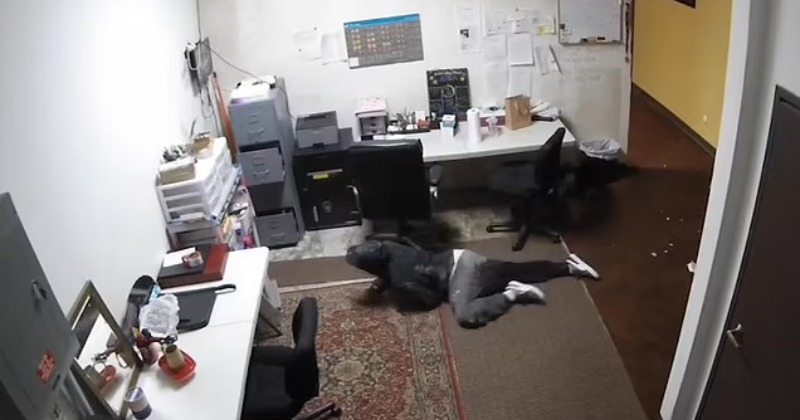
I want to click on electrical cable, so click(x=221, y=56).